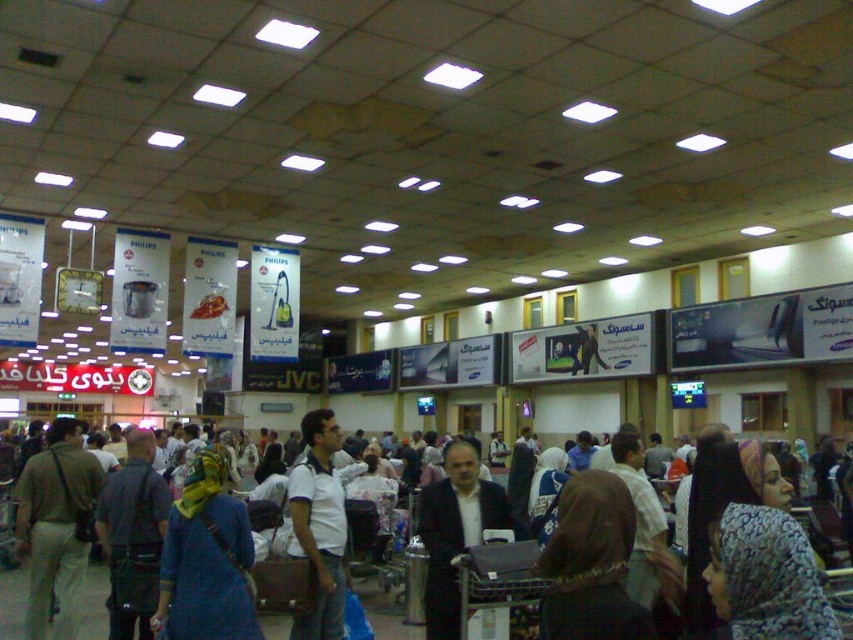
You are a photographer positioned at the entrance of the station. You want to take a photo of the blue fabric headscarf at center and the brown fabric crowd at center. Which object will appear larger in your photo?

The blue fabric headscarf at center will appear larger in the photo because it is closer to the viewer than the brown fabric crowd at center.

You are a traveler at the station and need to place your light brown fabric backpack at left on a bench located near the brown fabric crowd at center. Considering their widths, will the backpack fit on the bench without overlapping the crowd?

The light brown fabric backpack at left is wider than the brown fabric crowd at center. Since the backpack is wider, it might not fit on the bench without overlapping the crowd.